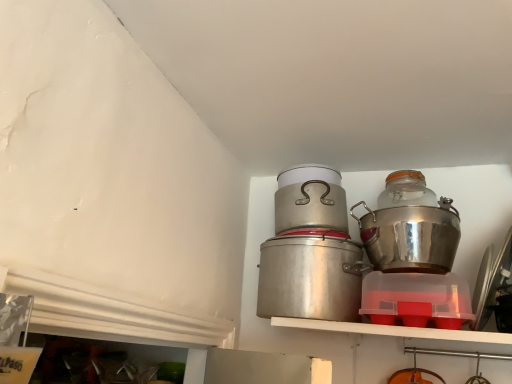
Question: Is shiny metallic pot at right, the first crock pot in the right-to-left sequence, wider or thinner than transparent glass jar at upper right?

Choices:
 (A) wide
 (B) thin

Answer: (A)

Question: Considering the positions of shiny metallic pot at right, the 2th crock pot positioned from the left, and transparent glass jar at upper right in the image, is shiny metallic pot at right, the 2th crock pot positioned from the left, bigger or smaller than transparent glass jar at upper right?

Choices:
 (A) small
 (B) big

Answer: (B)

Question: Based on their relative distances, which object is farther from the shiny metallic pot at right, the 2th crock pot positioned from the left?

Choices:
 (A) silver metallic crock pot at center, the 2th crock pot when ordered from right to left
 (B) transparent glass jar at upper right
 (C) metallic silver pot at center

Answer: (C)

Question: Which object is the closest to the transparent glass jar at upper right?

Choices:
 (A) silver metallic crock pot at center, the 2th crock pot when ordered from right to left
 (B) metallic silver pot at center
 (C) shiny metallic pot at right, the 2th crock pot positioned from the left

Answer: (C)